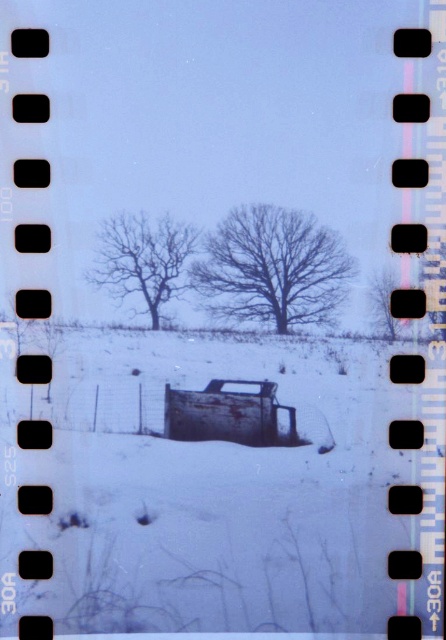
Does bare wood tree at center have a greater height compared to rusty metal truck at center?

Correct, bare wood tree at center is much taller as rusty metal truck at center.

Does bare wood tree at center have a smaller size compared to rusty metal truck at center?

Incorrect, bare wood tree at center is not smaller in size than rusty metal truck at center.

Is point (222, 310) closer to camera compared to point (202, 392)?

Yes, point (222, 310) is closer to viewer.

At what (x,y) coordinates should I click in order to perform the action: click on bare wood tree at center. Please return your answer as a coordinate pair (x, y). This screenshot has width=446, height=640. Looking at the image, I should click on (272, 268).

Does rusty metal truck at center have a greater height compared to smooth brown tree at center?

In fact, rusty metal truck at center may be shorter than smooth brown tree at center.

Image resolution: width=446 pixels, height=640 pixels. What do you see at coordinates (227, 413) in the screenshot?
I see `rusty metal truck at center` at bounding box center [227, 413].

Identify the location of rusty metal truck at center. [227, 413].

Which is more to the left, bare wood tree at center or smooth brown tree at center?

From the viewer's perspective, bare wood tree at center appears more on the left side.

Looking at this image, who is more forward, (260, 298) or (393, 276)?

Point (393, 276) is more forward.

Locate an element on the screen. Image resolution: width=446 pixels, height=640 pixels. bare wood tree at center is located at coordinates (272, 268).